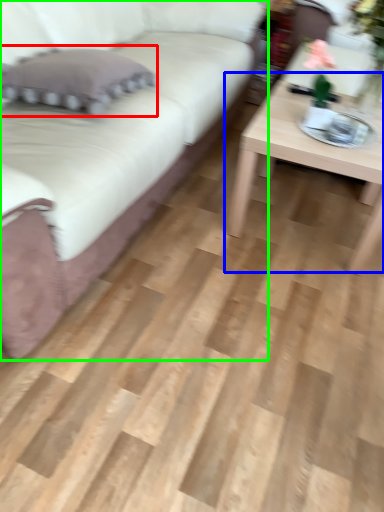
Question: Which object is positioned closest to pillow (highlighted by a red box)? Select from coffee table (highlighted by a blue box) and studio couch (highlighted by a green box).

Choices:
 (A) coffee table
 (B) studio couch

Answer: (B)